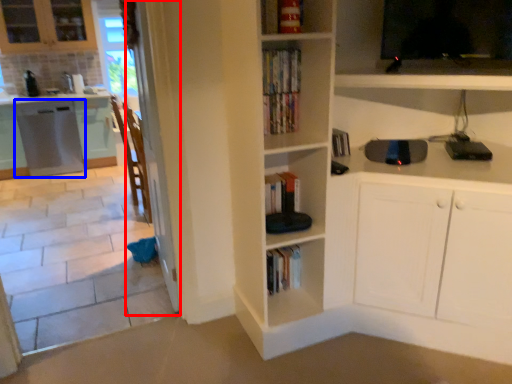
Question: Which object is closer to the camera taking this photo, screen door (highlighted by a red box) or cabinetry (highlighted by a blue box)?

Choices:
 (A) screen door
 (B) cabinetry

Answer: (A)